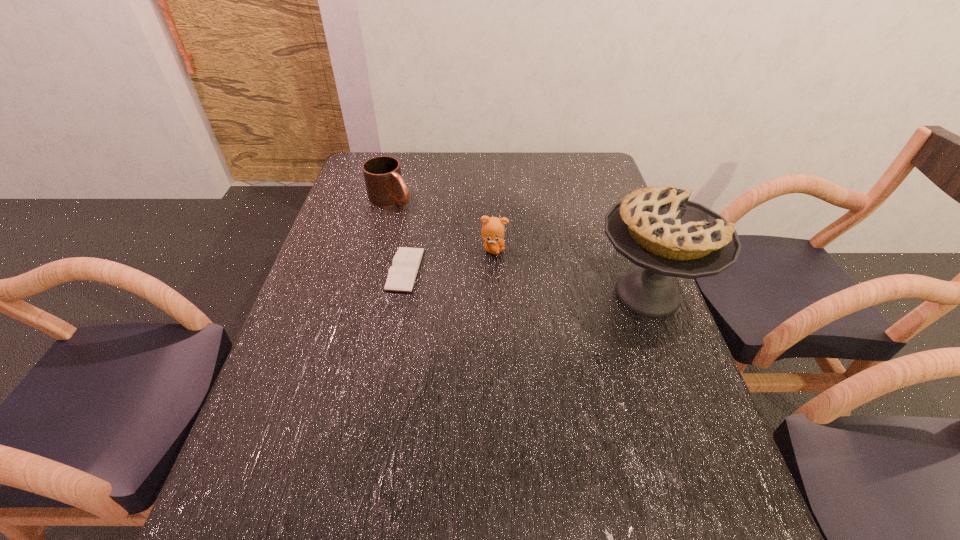
In order to click on the shortest object in this screenshot , I will do `click(402, 274)`.

You are a GUI agent. You are given a task and a screenshot of the screen. Output one action in this format:
    pyautogui.click(x=<x>, y=<y>)
    Task: Click on the tallest object
    The image size is (960, 540).
    Given the screenshot: What is the action you would take?
    pyautogui.click(x=657, y=228)

At what (x,y) coordinates should I click in order to perform the action: click on pie. Please return your answer as a coordinate pair (x, y). The image size is (960, 540). Looking at the image, I should click on (657, 228).

Find the location of a particular element. This screenshot has width=960, height=540. the farthest object is located at coordinates (385, 186).

Find the location of a particular element. The image size is (960, 540). the third object from left to right is located at coordinates (x=492, y=231).

Find the location of a particular element. vacant point located on the right of the diary is located at coordinates (469, 269).

Image resolution: width=960 pixels, height=540 pixels. In order to click on free location located 0.230m on the side of the farthest object with the handle in this screenshot , I will do `click(455, 238)`.

Locate an element on the screen. The height and width of the screenshot is (540, 960). vacant position located 0.240m on the side of the farthest object with the handle is located at coordinates (457, 240).

The image size is (960, 540). Find the location of `vacant point located 0.310m on the side of the farthest object with the handle`. vacant point located 0.310m on the side of the farthest object with the handle is located at coordinates (474, 250).

I want to click on vacant space located on the face of the teddy bear, so pos(540,277).